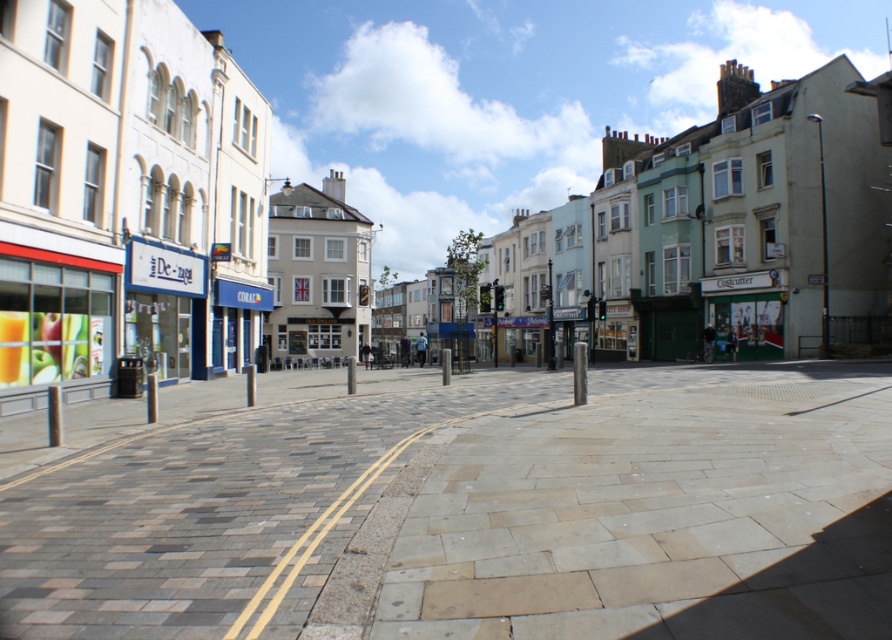
Does paved stone pavement at center appear on the left side of matte white building at center?

Indeed, paved stone pavement at center is positioned on the left side of matte white building at center.

Is point (84, 516) positioned before point (141, 195)?

Yes, point (84, 516) is closer to viewer.

Is point (345, 572) in front of point (300, 40)?

Yes.

Where is `paved stone pavement at center`? paved stone pavement at center is located at coordinates (461, 506).